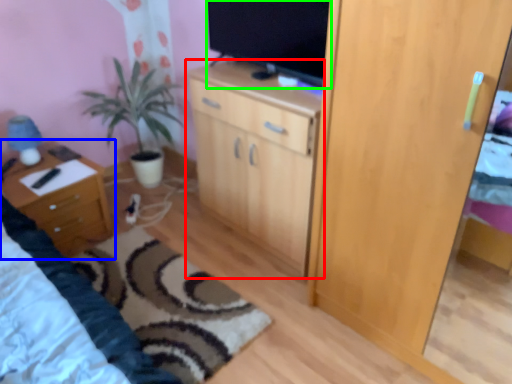
Question: Based on their relative distances, which object is nearer to cabinetry (highlighted by a red box)? Choose from nightstand (highlighted by a blue box) and television (highlighted by a green box).

Choices:
 (A) nightstand
 (B) television

Answer: (B)